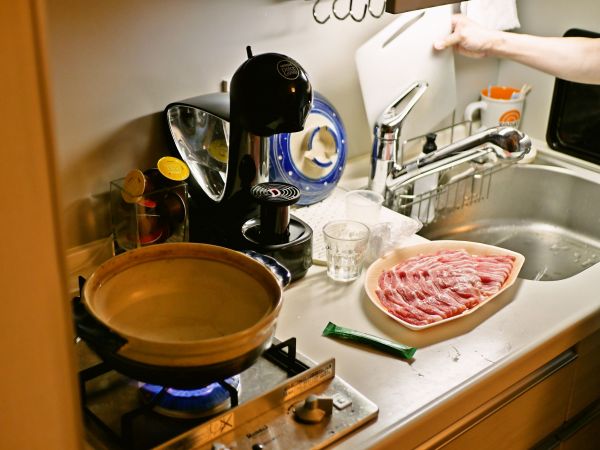
At what (x,y) coordinates should I click in order to perform the action: click on flame from gas stove. Please return your answer as a coordinate pair (x, y). The width and height of the screenshot is (600, 450). Looking at the image, I should click on (202, 392).